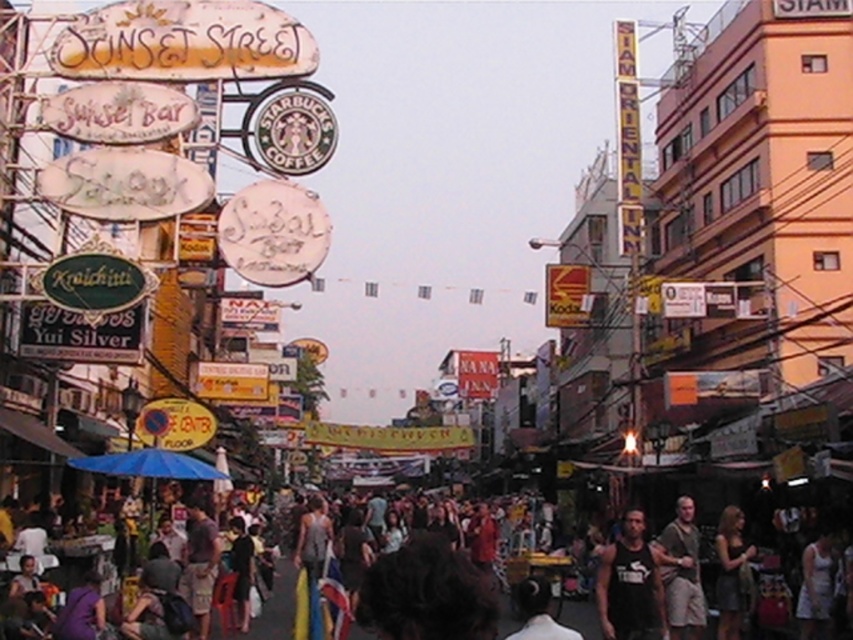
You are a photographer standing on the bustling street scene. You want to take a photo of the black tank top at lower right and the brown textured shirt at lower right. Which one should you focus on first to ensure both are in sharp focus?

You should focus on the black tank top at lower right first because it is closer to the viewer than the brown textured shirt at lower right. By focusing on the closer object, the background object may still be in acceptable focus depending on the lens aperture and distance between them.